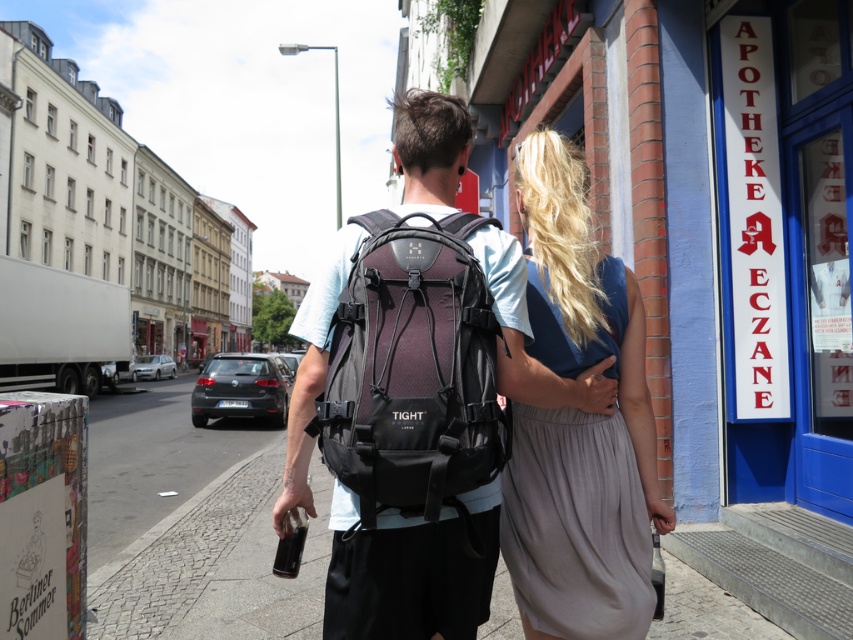
Can you confirm if cobblestone pavement at center is bigger than matte black backpack at center?

Actually, cobblestone pavement at center might be smaller than matte black backpack at center.

Based on the photo, can you confirm if cobblestone pavement at center is taller than matte black backpack at center?

No, cobblestone pavement at center is not taller than matte black backpack at center.

At what (x,y) coordinates should I click in order to perform the action: click on cobblestone pavement at center. Please return your answer as a coordinate pair (x, y). This screenshot has width=853, height=640. Looking at the image, I should click on (218, 564).

Between light gray fabric dress at center and matte purple fabric backpack at center, which one appears on the right side from the viewer's perspective?

From the viewer's perspective, light gray fabric dress at center appears more on the right side.

Does point (550, 312) come in front of point (428, 516)?

No, it is behind (428, 516).

Locate an element on the screen. Image resolution: width=853 pixels, height=640 pixels. light gray fabric dress at center is located at coordinates (579, 422).

The height and width of the screenshot is (640, 853). Describe the element at coordinates (579, 422) in the screenshot. I see `light gray fabric dress at center` at that location.

Which is more to the left, light gray fabric dress at center or matte black backpack at center?

Positioned to the left is matte black backpack at center.

Is point (537, 582) behind point (546, 154)?

No, (537, 582) is in front of (546, 154).

The width and height of the screenshot is (853, 640). Find the location of `light gray fabric dress at center`. light gray fabric dress at center is located at coordinates (579, 422).